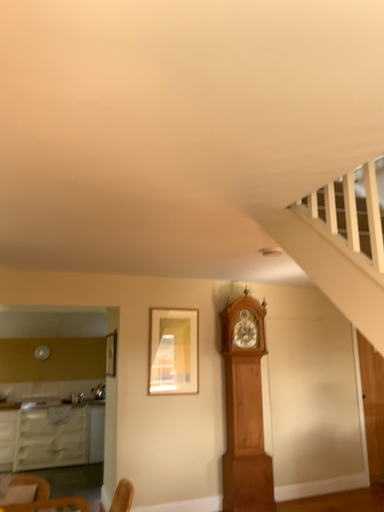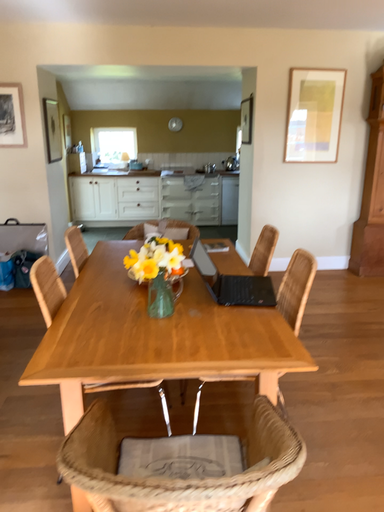
Question: Which way did the camera rotate in the video?

Choices:
 (A) rotated right
 (B) rotated left

Answer: (B)